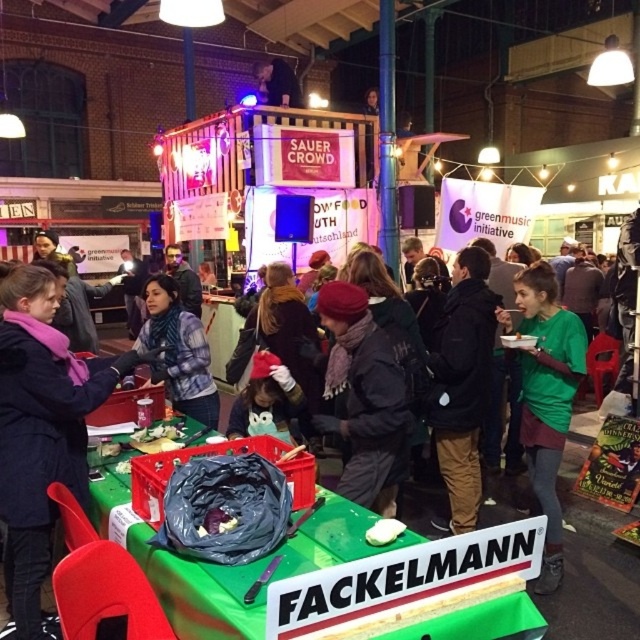
Does plaid fabric jacket at center appear on the right side of smooth purple potato at center?

Incorrect, plaid fabric jacket at center is not on the right side of smooth purple potato at center.

Does plaid fabric jacket at center have a larger size compared to smooth purple potato at center?

Correct, plaid fabric jacket at center is larger in size than smooth purple potato at center.

At what (x,y) coordinates should I click in order to perform the action: click on plaid fabric jacket at center. Please return your answer as a coordinate pair (x, y). This screenshot has height=640, width=640. Looking at the image, I should click on (177, 352).

The image size is (640, 640). Identify the location of plaid fabric jacket at center. (177, 352).

Who is more distant from viewer, (365, 388) or (234, 524)?

The point (365, 388) is more distant.

Does point (387, 353) come farther from viewer compared to point (220, 513)?

Yes, it is behind point (220, 513).

Does point (333, 372) come closer to viewer compared to point (212, 525)?

No, it is behind (212, 525).

In order to click on dark gray knit hat at center in this screenshot , I will do `click(364, 397)`.

Can you confirm if plaid fabric jacket at center is smaller than white matte cheese at center?

No.

Which is behind, point (205, 413) or point (380, 529)?

The point (205, 413) is more distant.

Which is behind, point (173, 356) or point (394, 522)?

The point (173, 356) is more distant.

This screenshot has width=640, height=640. Find the location of `plaid fabric jacket at center`. plaid fabric jacket at center is located at coordinates (177, 352).